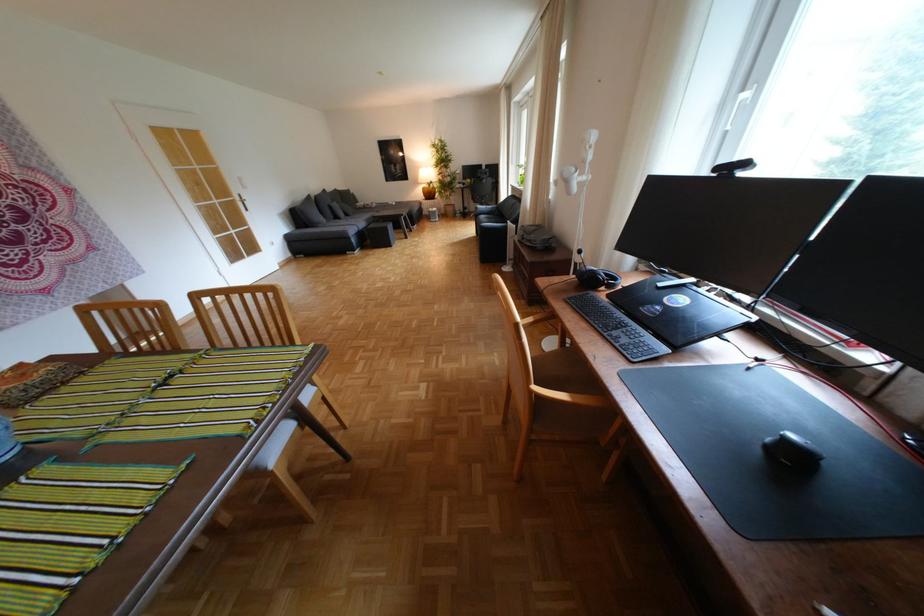
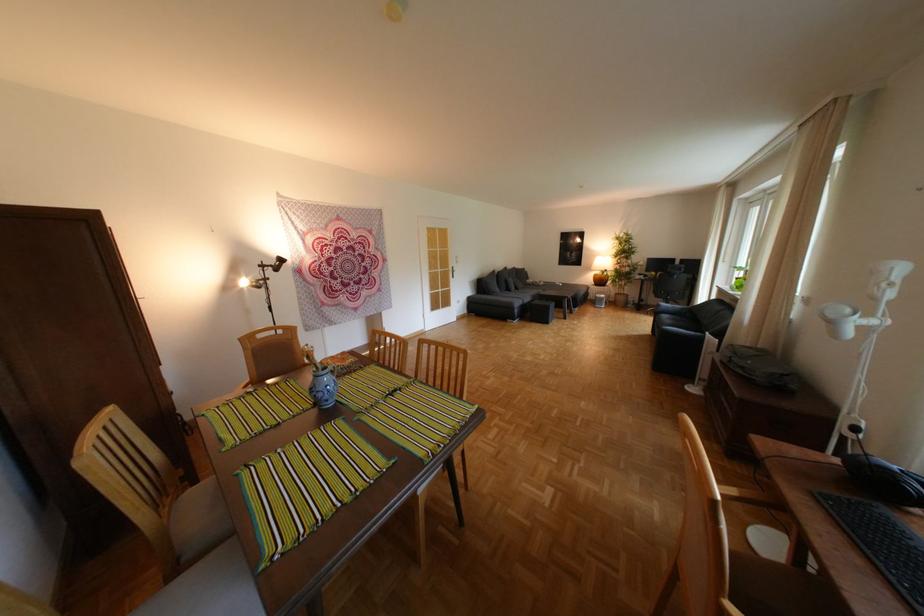
In the second image, find the point that corresponds to point (597, 161) in the first image.

(888, 299)